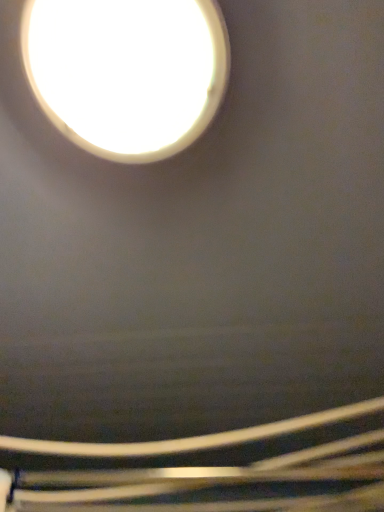
In order to click on white glossy light bulb at upper left in this screenshot , I will do `click(127, 72)`.

What do you see at coordinates (127, 72) in the screenshot?
I see `white glossy light bulb at upper left` at bounding box center [127, 72].

You are a GUI agent. You are given a task and a screenshot of the screen. Output one action in this format:
    pyautogui.click(x=<x>, y=<y>)
    Task: Click on the white glossy light bulb at upper left
    
    Given the screenshot: What is the action you would take?
    pyautogui.click(x=127, y=72)